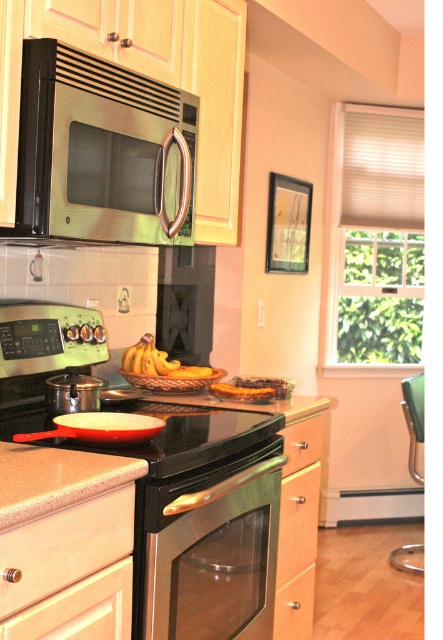
Question: Which object appears closest to the camera in this image?

Choices:
 (A) wooden drawer at lower center
 (B) yellow matte bananas at center
 (C) wooden drawer at lower right
 (D) light wood/wooden drawer at lower left

Answer: (D)

Question: Which of the following is the farthest from the observer?

Choices:
 (A) (208, 432)
 (B) (0, 592)
 (C) (304, 598)

Answer: (C)

Question: Does stainless steel stove at center appear under matte red pan at center?

Choices:
 (A) yes
 (B) no

Answer: (A)

Question: Which of the following is the closest to the observer?

Choices:
 (A) (178, 506)
 (B) (147, 349)

Answer: (A)

Question: Is matte wood drawer at lower center below golden brown bread at center?

Choices:
 (A) yes
 (B) no

Answer: (A)

Question: Considering the relative positions of light wood/wooden drawer at lower left and matte wood drawer at lower center in the image provided, where is light wood/wooden drawer at lower left located with respect to matte wood drawer at lower center?

Choices:
 (A) above
 (B) below

Answer: (A)